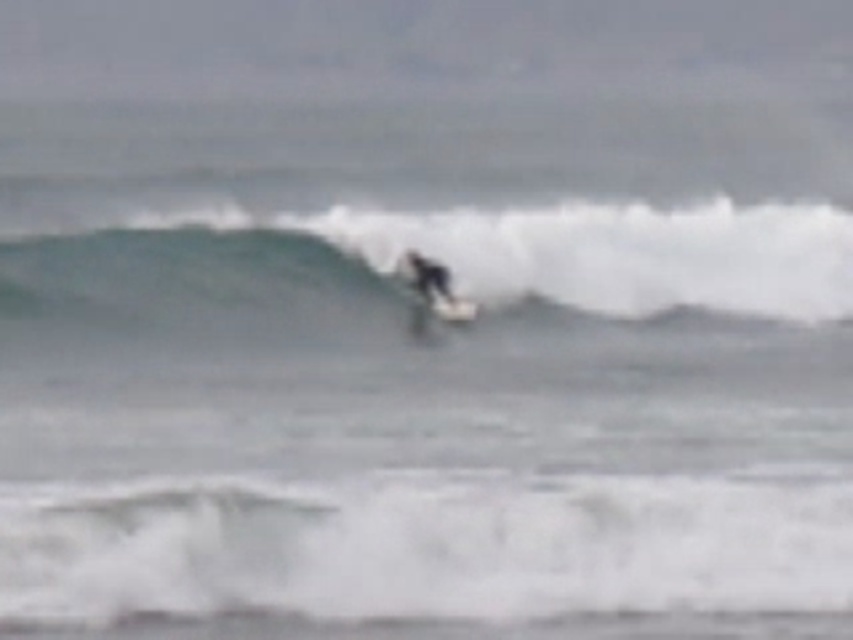
Is green rubber surfboard at center further to the viewer compared to white matte surfboard at center?

No, green rubber surfboard at center is in front of white matte surfboard at center.

How distant is green rubber surfboard at center from white matte surfboard at center?

green rubber surfboard at center is 2.78 meters away from white matte surfboard at center.

Which is in front, point (776, 237) or point (457, 308)?

Point (457, 308) is in front.

Locate an element on the screen. This screenshot has width=853, height=640. green rubber surfboard at center is located at coordinates (527, 252).